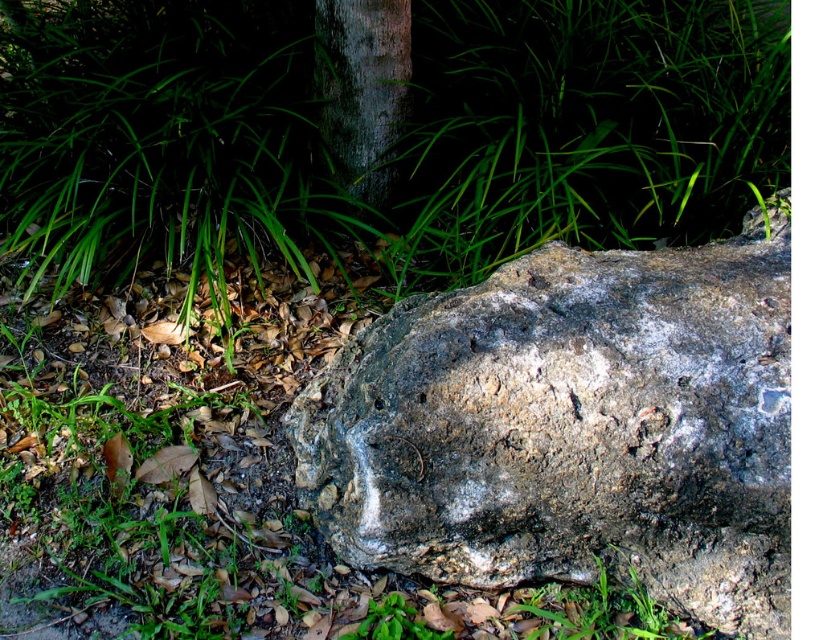
Question: Is gray rough rock at center smaller than smooth gray bark at center?

Choices:
 (A) no
 (B) yes

Answer: (A)

Question: Among these points, which one is nearest to the camera?

Choices:
 (A) click(x=565, y=570)
 (B) click(x=323, y=45)

Answer: (A)

Question: Can you confirm if gray rough rock at center is positioned to the right of smooth gray bark at center?

Choices:
 (A) no
 (B) yes

Answer: (B)

Question: Is gray rough rock at center thinner than smooth gray bark at center?

Choices:
 (A) yes
 (B) no

Answer: (B)

Question: Which point appears closest to the camera in this image?

Choices:
 (A) (329, 536)
 (B) (323, 102)

Answer: (A)

Question: Which object appears closest to the camera in this image?

Choices:
 (A) gray rough rock at center
 (B) smooth gray bark at center

Answer: (A)